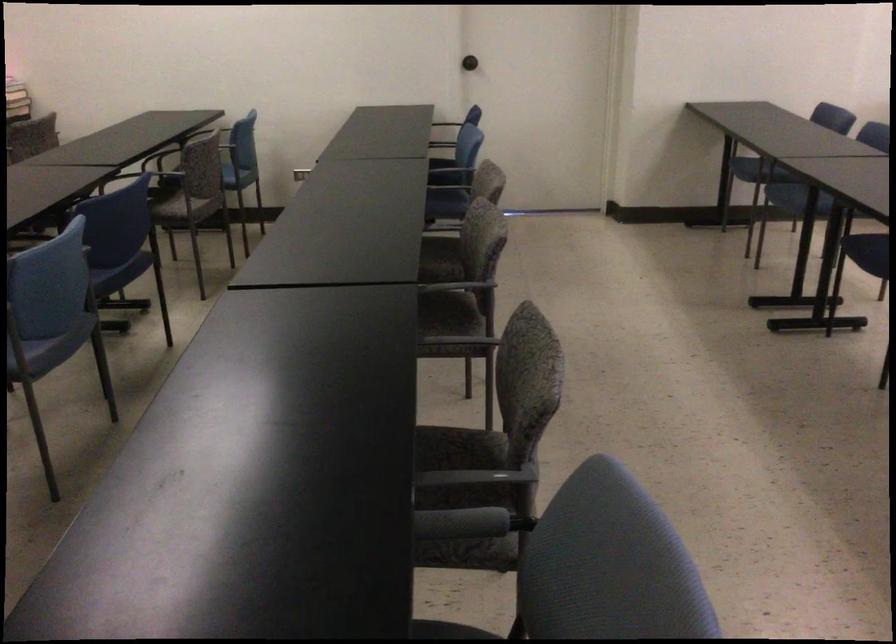
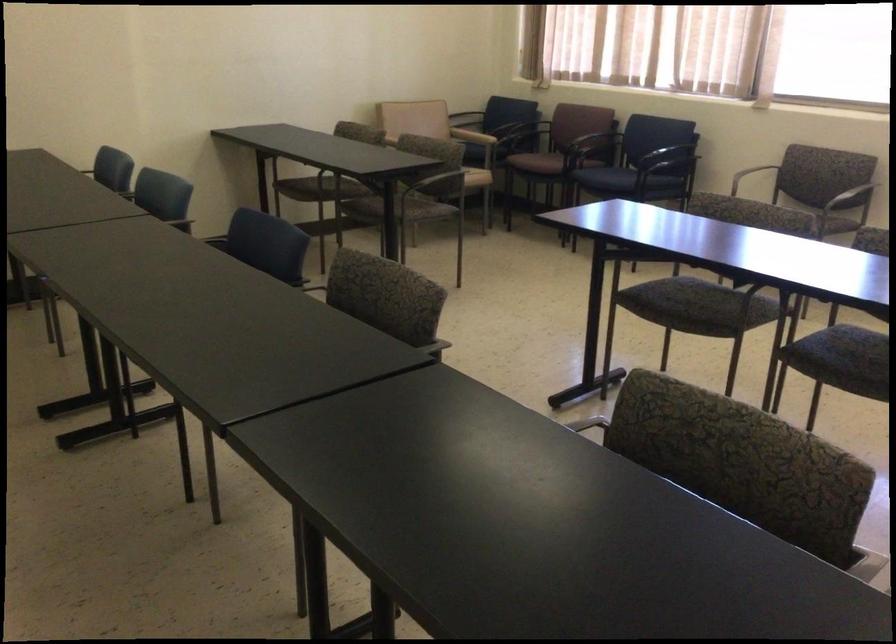
Question: The first image is from the beginning of the video and the second image is from the end. How did the camera likely rotate when shooting the video?

Choices:
 (A) Left
 (B) Right
 (C) Up
 (D) Down

Answer: (B)